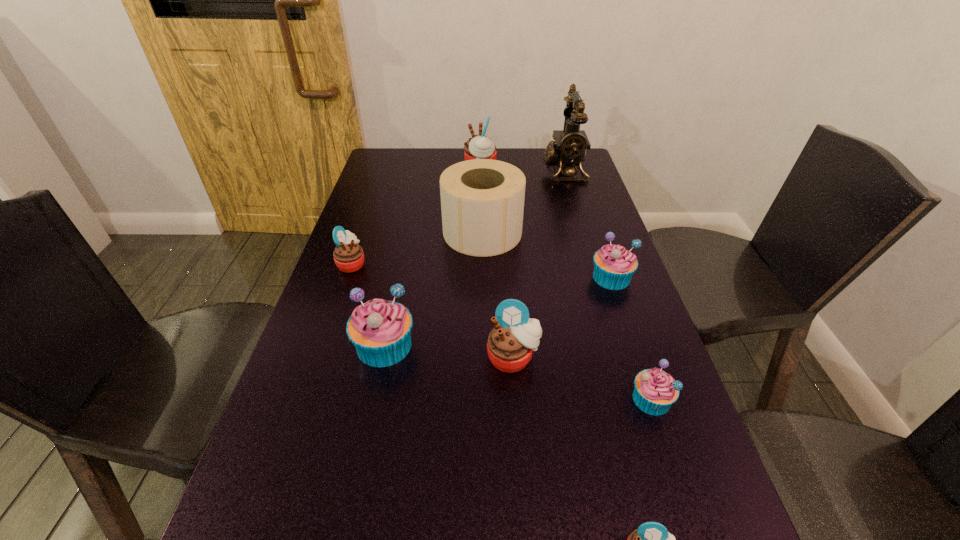
This screenshot has height=540, width=960. Find the location of `telephone`. telephone is located at coordinates (569, 147).

The image size is (960, 540). Identify the location of the farthest muffin. 478,147.

I want to click on the tallest muffin, so click(478, 147).

Locate an element on the screen. toilet tissue is located at coordinates (482, 200).

Where is `the leftmost blue muffin`? Image resolution: width=960 pixels, height=540 pixels. the leftmost blue muffin is located at coordinates (380, 330).

What are the coordinates of `the second object from left to right` in the screenshot? It's located at (380, 330).

Identify the location of the third farthest pink muffin. This screenshot has width=960, height=540. (510, 345).

Find the location of a particular element. the leftmost muffin is located at coordinates [348, 256].

Where is `the third biggest pink muffin`? Image resolution: width=960 pixels, height=540 pixels. the third biggest pink muffin is located at coordinates (348, 256).

Locate an element on the screen. the farthest blue muffin is located at coordinates (614, 265).